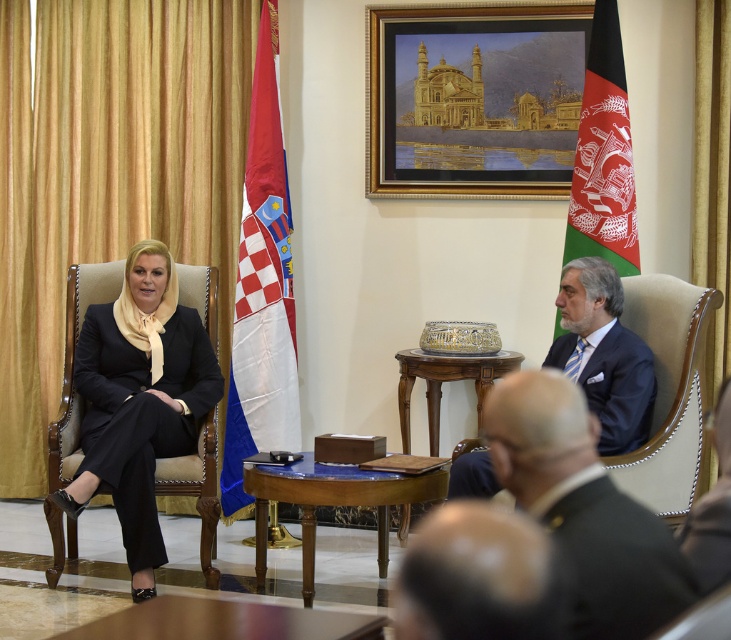
Is white fabric flag at center thinner than wooden polished table at center?

Yes, white fabric flag at center is thinner than wooden polished table at center.

Does white fabric flag at center appear on the right side of wooden polished table at center?

In fact, white fabric flag at center is to the left of wooden polished table at center.

This screenshot has width=731, height=640. Describe the element at coordinates (261, 291) in the screenshot. I see `white fabric flag at center` at that location.

I want to click on white fabric flag at center, so click(x=261, y=291).

Does dark blue suit at center have a larger size compared to mahogany wood table at center?

No.

Who is higher up, dark blue suit at center or mahogany wood table at center?

dark blue suit at center

Is point (590, 435) more distant than point (439, 468)?

No, (590, 435) is closer to viewer.

You are a GUI agent. You are given a task and a screenshot of the screen. Output one action in this format:
    pyautogui.click(x=<x>, y=<y>)
    Task: Click on the dark blue suit at center
    
    Given the screenshot: What is the action you would take?
    pyautogui.click(x=583, y=506)

Who is shorter, gold-framed painting at upper center or dark blue suit at center?

Standing shorter between the two is dark blue suit at center.

Is gold-framed painting at upper center shorter than dark blue suit at center?

Incorrect, gold-framed painting at upper center's height does not fall short of dark blue suit at center's.

Does point (431, 109) lie in front of point (501, 385)?

That is False.

Locate an element on the screen. Image resolution: width=731 pixels, height=640 pixels. gold-framed painting at upper center is located at coordinates (473, 99).